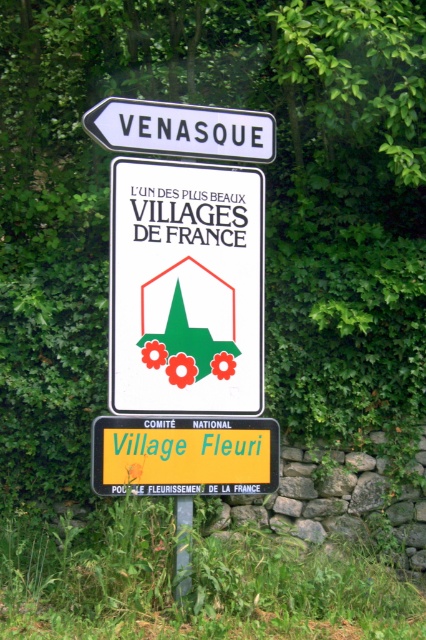
You are a hiker who needs to adjust your backpack to access your map. You see the white paper sign at upper center and the metallic pole at center. Which object is located higher up?

The white paper sign at upper center is positioned over the metallic pole at center, so it is higher up.

You are standing at the point with coordinates point [149,468] and want to walk towards the point with coordinates point [154,364]. Will the signpost block your path?

Point [154,364] is behind point [149,468], so the signpost will block your path to the point [154,364].